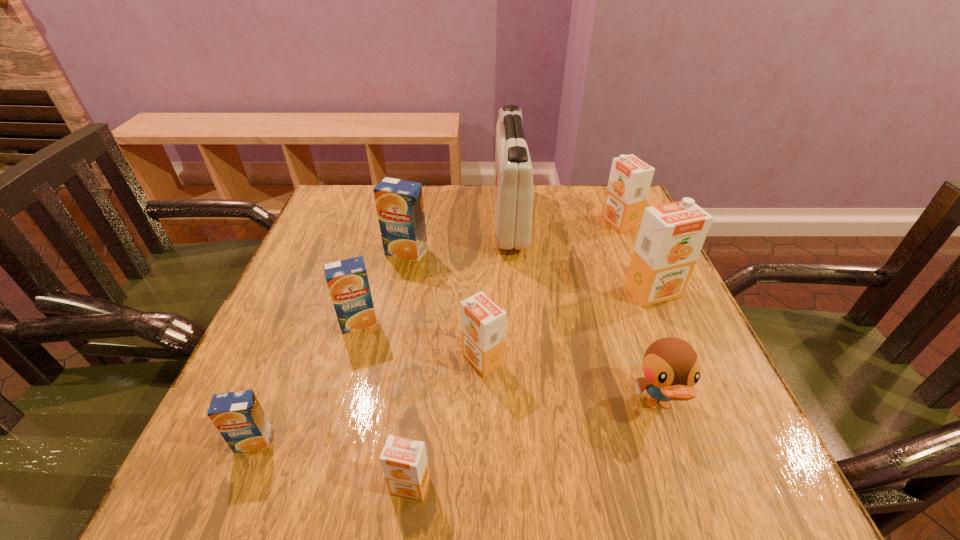
This screenshot has width=960, height=540. I want to click on the first-aid kit, so click(513, 194).

At what (x,y) coordinates should I click in order to perform the action: click on the tallest object. Please return your answer as a coordinate pair (x, y). Image resolution: width=960 pixels, height=540 pixels. Looking at the image, I should click on (513, 194).

The height and width of the screenshot is (540, 960). I want to click on the biggest orange orange juice, so click(x=671, y=236).

Identify the location of the eighth shortest object. (671, 236).

Where is `the farthest blue orange_juice`? This screenshot has height=540, width=960. the farthest blue orange_juice is located at coordinates [x=399, y=203].

Where is `the biggest blue orange_juice`? The image size is (960, 540). the biggest blue orange_juice is located at coordinates (399, 203).

The height and width of the screenshot is (540, 960). What are the coordinates of `the third smallest orange orange juice` in the screenshot? It's located at pos(630,178).

Locate an element on the screen. the farthest orange orange juice is located at coordinates (630, 178).

Identify the location of the fourth farthest orange juice. This screenshot has width=960, height=540. (347, 280).

Find the location of a particular element. the fifth farthest object is located at coordinates (347, 280).